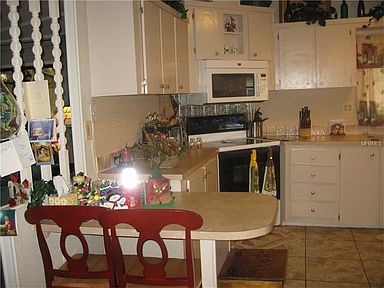
At what (x,y) coordinates should I click in order to perform the action: click on wooden knife block. Please return your answer as a coordinate pair (x, y). The height and width of the screenshot is (288, 384). Looking at the image, I should click on (307, 130).